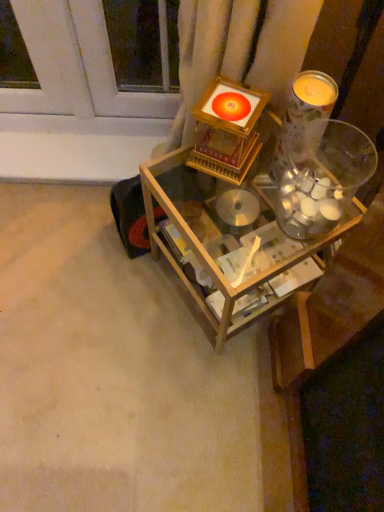
Where is `free space in front of wooden table at center`? Image resolution: width=384 pixels, height=512 pixels. free space in front of wooden table at center is located at coordinates (194, 390).